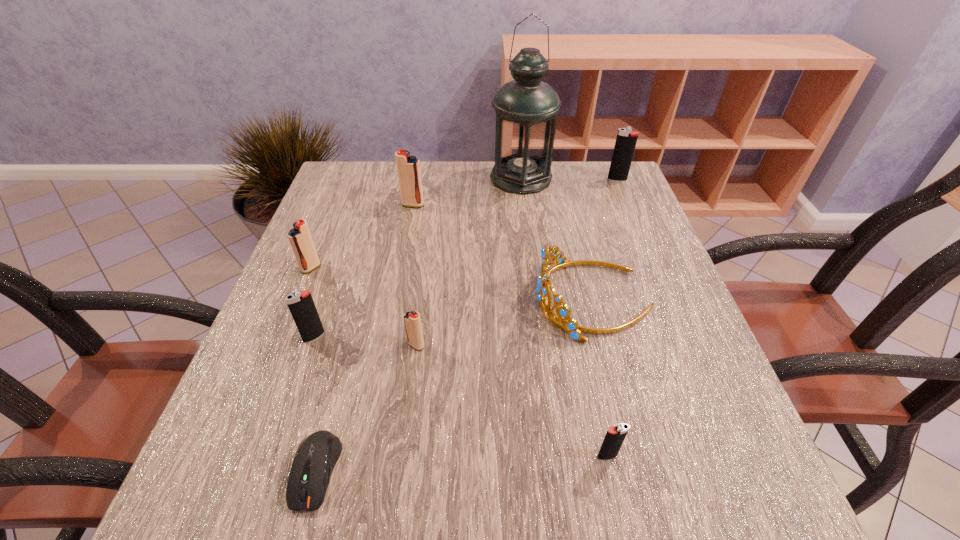
Where is `vacant space at the far right corner of the desktop`? vacant space at the far right corner of the desktop is located at coordinates (600, 190).

At what (x,y) coordinates should I click in order to perform the action: click on free space that is in between the second smallest black igniter and the green oil lamp. Please return your answer as a coordinate pair (x, y). Image resolution: width=960 pixels, height=540 pixels. Looking at the image, I should click on (418, 257).

Where is `vacant region between the computer equipment and the third igniter from right to left`? Image resolution: width=960 pixels, height=540 pixels. vacant region between the computer equipment and the third igniter from right to left is located at coordinates (366, 408).

You are a GUI agent. You are given a task and a screenshot of the screen. Output one action in this format:
    pyautogui.click(x=<x>, y=<y>)
    Task: Click on the vacant area that lies between the eighth object from right to left and the gold tiara
    
    Given the screenshot: What is the action you would take?
    pyautogui.click(x=453, y=318)

At what (x,y) coordinates should I click in order to perform the action: click on free spot between the dark computer equipment and the rightmost igniter. Please return your answer as a coordinate pair (x, y). The image size is (960, 540). Looking at the image, I should click on (467, 325).

I want to click on free spot between the third igniter from right to left and the fourth object from left to right, so (x=415, y=275).

Where is `free point between the fifth igniter from left to right and the dark computer equipment`? This screenshot has width=960, height=540. free point between the fifth igniter from left to right and the dark computer equipment is located at coordinates (462, 463).

Find the location of `vacant area between the second black igniter from right to left and the nearest red igniter`. vacant area between the second black igniter from right to left and the nearest red igniter is located at coordinates pyautogui.click(x=512, y=401).

This screenshot has height=540, width=960. Find the location of `unoccupied position between the farthest igniter and the fourth igniter from left to right`. unoccupied position between the farthest igniter and the fourth igniter from left to right is located at coordinates (516, 262).

I want to click on vacant point located between the farthest black igniter and the green oil lamp, so click(x=569, y=179).